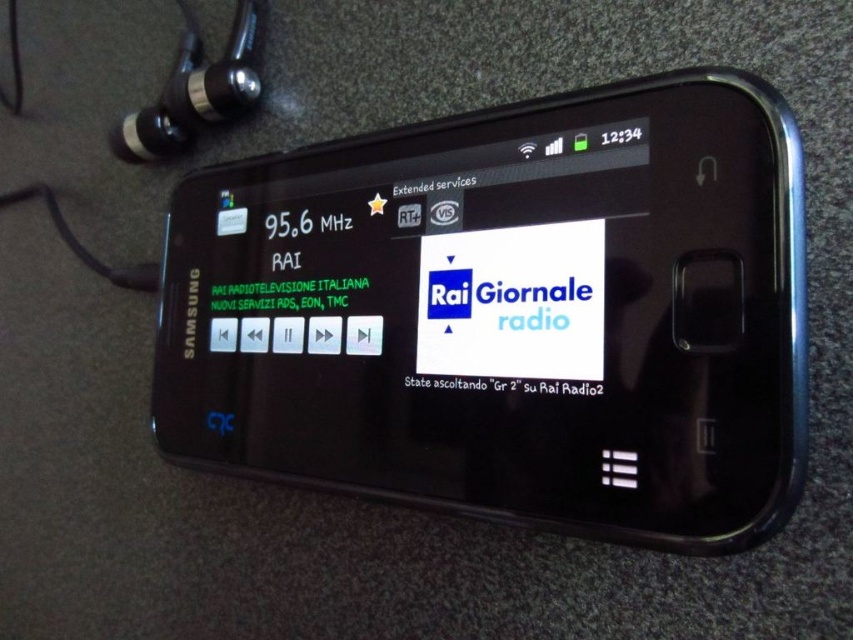
Question: From the image, what is the correct spatial relationship of black plastic smartphone at center in relation to black metallic earphone at upper left?

Choices:
 (A) left
 (B) right

Answer: (B)

Question: Observing the image, what is the correct spatial positioning of black plastic smartphone at center in reference to black metallic earphone at upper left?

Choices:
 (A) above
 (B) below

Answer: (B)

Question: Which point is closer to the camera?

Choices:
 (A) (708, 250)
 (B) (202, 99)

Answer: (A)

Question: Where is black plastic smartphone at center located in relation to black metallic earphone at upper left in the image?

Choices:
 (A) right
 (B) left

Answer: (A)